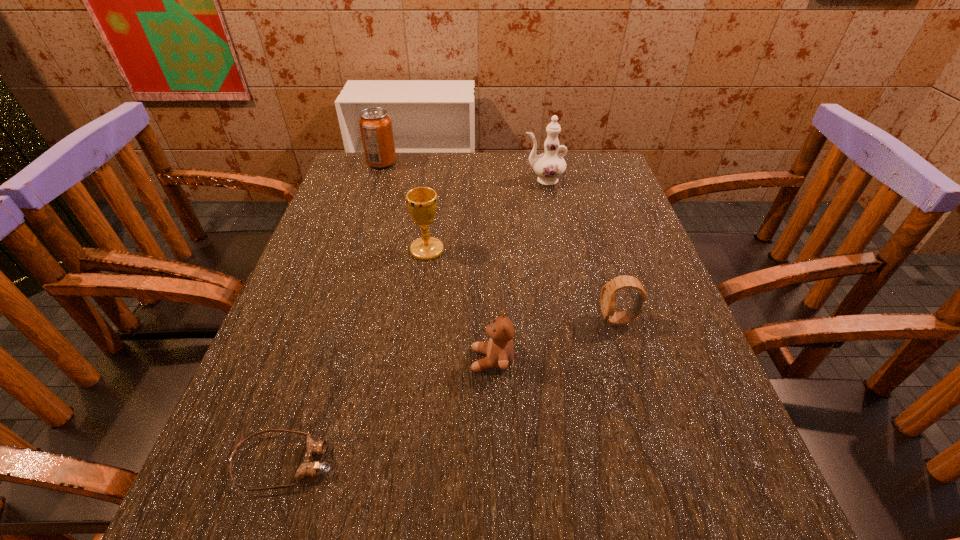
Where is `empty location between the nearest object and the chalice`? The image size is (960, 540). empty location between the nearest object and the chalice is located at coordinates (356, 356).

I want to click on empty space between the farthest object and the third object from left to right, so click(404, 206).

Find the location of a particular element. vacant area that lies between the chinaware and the farthest object is located at coordinates (463, 171).

Where is `vacant area between the fifth nearest object and the shortest object`? vacant area between the fifth nearest object and the shortest object is located at coordinates (414, 321).

Image resolution: width=960 pixels, height=540 pixels. I want to click on free spot between the watch and the soda can, so click(500, 241).

Where is `free space between the second nearest object and the farthest object`? free space between the second nearest object and the farthest object is located at coordinates (437, 261).

Find the location of a particular element. blank region between the tallest object and the fourth farthest object is located at coordinates (581, 250).

I want to click on free space that is in between the soda can and the fourth nearest object, so click(404, 206).

Identify the location of object identified as the second closest to the shortest object. (422, 201).

Select which object is the second closest to the chinaware. Please provide its 2D coordinates. Your answer should be formatted as a tuple, i.e. [(x, y)], where the tuple contains the x and y coordinates of a point satisfying the conditions above.

[(375, 124)]